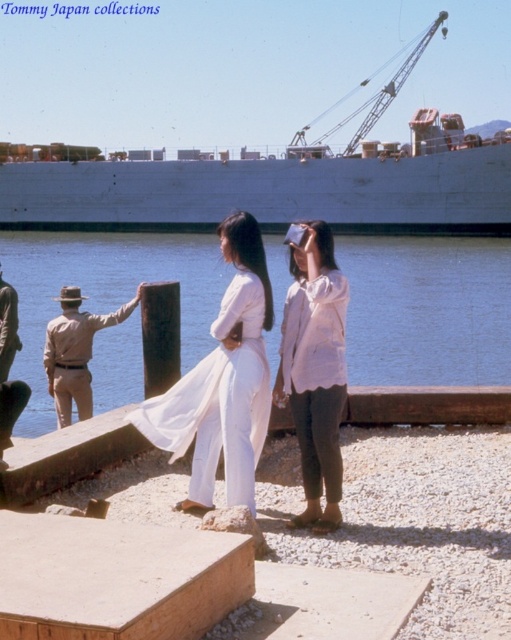
Question: Considering the relative positions of blue water at center and white matte ship at upper center in the image provided, where is blue water at center located with respect to white matte ship at upper center?

Choices:
 (A) above
 (B) below

Answer: (B)

Question: Which point appears farthest from the camera in this image?

Choices:
 (A) (86, 333)
 (B) (246, 275)
 (C) (11, 432)
 (D) (373, 141)

Answer: (D)

Question: Which point is closer to the camera taking this photo?

Choices:
 (A) (67, 253)
 (B) (354, 161)
 (C) (3, 435)
 (D) (212, 497)

Answer: (D)

Question: Is blue water at center wider than light beige cotton shirt at center?

Choices:
 (A) no
 (B) yes

Answer: (B)

Question: In this image, where is white matte ship at upper center located relative to light beige cotton shirt at center?

Choices:
 (A) left
 (B) right

Answer: (A)

Question: Which object is closer to the camera taking this photo?

Choices:
 (A) white silk dress at center
 (B) light beige cotton shirt at center
 (C) khaki cotton pants at left
 (D) white matte ship at upper center

Answer: (A)